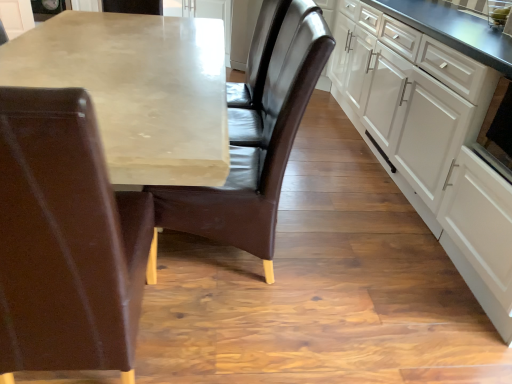
The width and height of the screenshot is (512, 384). What are the coordinates of `vacant area located to the right-hand side of leather chair at left, which is the first chair from left to right` in the screenshot? It's located at (214, 336).